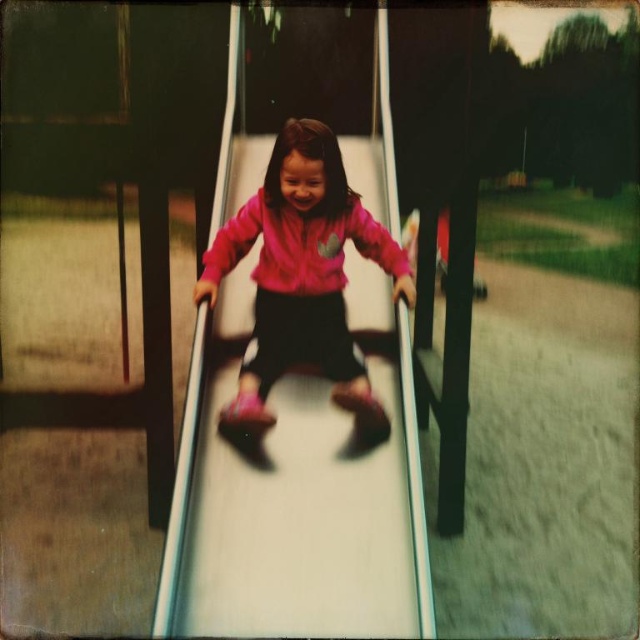
Question: Where is white plastic slide at center located in relation to pink matte jacket at center in the image?

Choices:
 (A) right
 (B) left

Answer: (A)

Question: Is the position of white plastic slide at center less distant than that of pink matte jacket at center?

Choices:
 (A) no
 (B) yes

Answer: (B)

Question: Which point is closer to the camera?

Choices:
 (A) white plastic slide at center
 (B) pink matte jacket at center

Answer: (A)

Question: Which point appears farthest from the camera in this image?

Choices:
 (A) (324, 369)
 (B) (417, 596)

Answer: (A)

Question: Does white plastic slide at center appear on the left side of pink matte jacket at center?

Choices:
 (A) no
 (B) yes

Answer: (A)